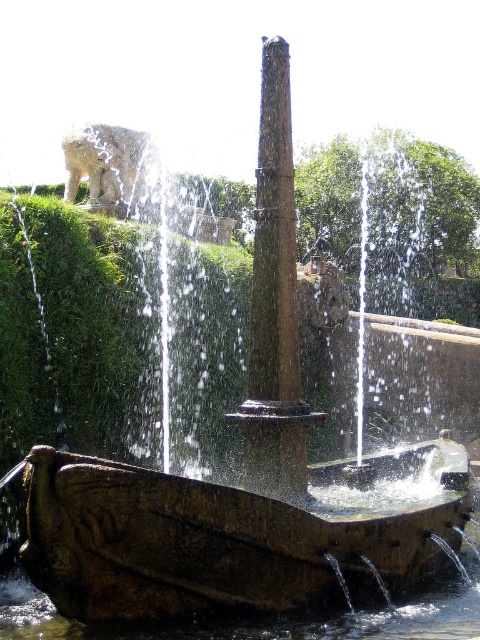
Where is the rusty stone boat at center located in the image?

The rusty stone boat at center is located at point (220, 540) in the image.

You are standing at the edge of the fountain basin and want to place a small statue on top of the brown stone pillar at center. Can you place it there without it falling off, considering the position of the rusty stone boat at center?

The rusty stone boat at center is located below the brown stone pillar at center, so placing the statue on top of the brown stone pillar at center would be stable as the pillar is above the boat and provides a solid base.

You are a visitor at the park and want to take a photo of the rusty stone boat at center and the brown stone pillar at center. Which object should you focus on first if you want to capture both in a single frame without moving the camera?

The rusty stone boat at center is not as tall as the brown stone pillar at center, so you should focus on the brown stone pillar at center first to ensure both are in frame.